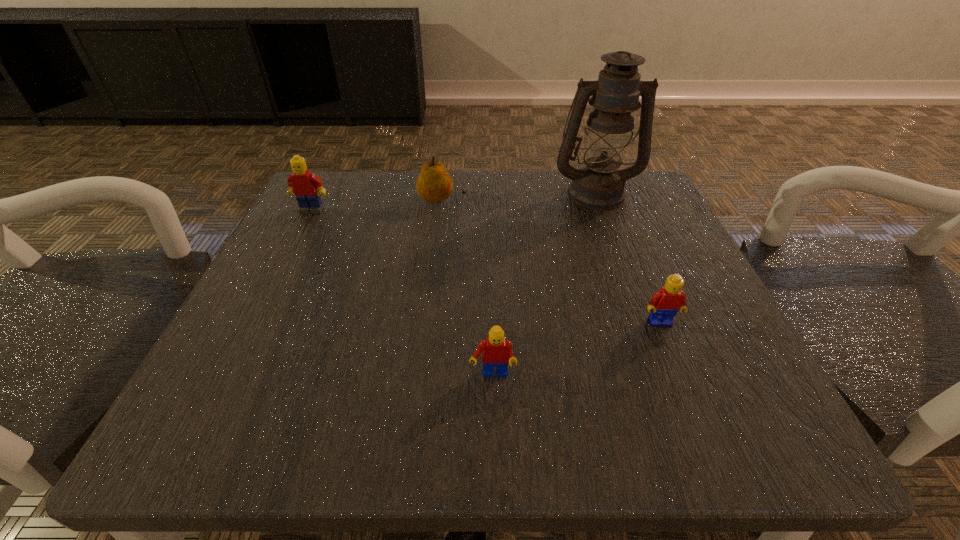
At what (x,y) coordinates should I click in order to perform the action: click on vacant region located 0.310m on the front of the second object from left to right. Please return your answer as a coordinate pair (x, y). The image size is (960, 540). Looking at the image, I should click on (428, 324).

You are a GUI agent. You are given a task and a screenshot of the screen. Output one action in this format:
    pyautogui.click(x=<x>, y=<y>)
    Task: Click on the free location located on the front-facing side of the rightmost Lego
    The width and height of the screenshot is (960, 540).
    Given the screenshot: What is the action you would take?
    pyautogui.click(x=702, y=426)

I want to click on oil lamp that is at the far edge, so click(x=599, y=185).

Where is `Lego present at the far edge`? Lego present at the far edge is located at coordinates (307, 186).

Locate an element on the screen. The width and height of the screenshot is (960, 540). pear at the far edge is located at coordinates (434, 184).

Where is `object that is at the near edge`? The image size is (960, 540). object that is at the near edge is located at coordinates (496, 351).

Where is `object located at the left edge`? Image resolution: width=960 pixels, height=540 pixels. object located at the left edge is located at coordinates (307, 186).

You are a GUI agent. You are given a task and a screenshot of the screen. Output one action in this format:
    pyautogui.click(x=<x>, y=<y>)
    Task: Click on the oil lamp that is at the right edge
    
    Given the screenshot: What is the action you would take?
    pyautogui.click(x=599, y=185)

Identify the location of Lego positioned at the right edge. (665, 303).

Locate an element on the screen. object present at the far left corner is located at coordinates (307, 186).